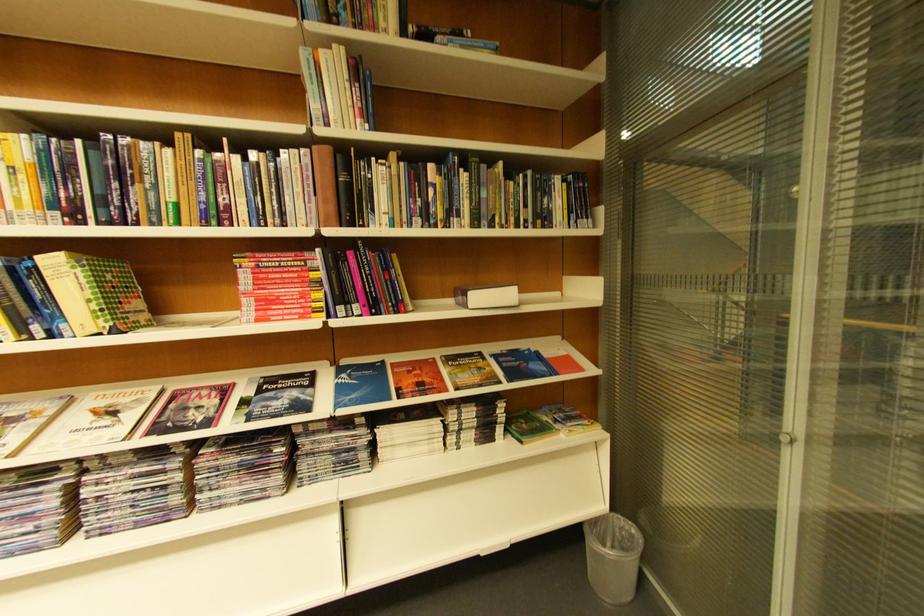
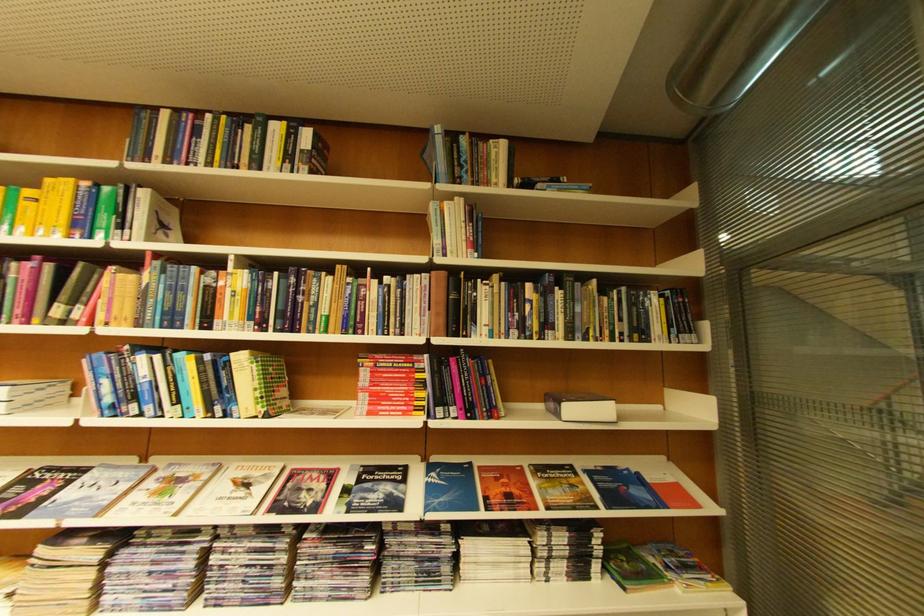
Based on the photo, in a continuous first-person perspective shot, in which direction is the camera moving?

The cameraman moved toward left, backward.